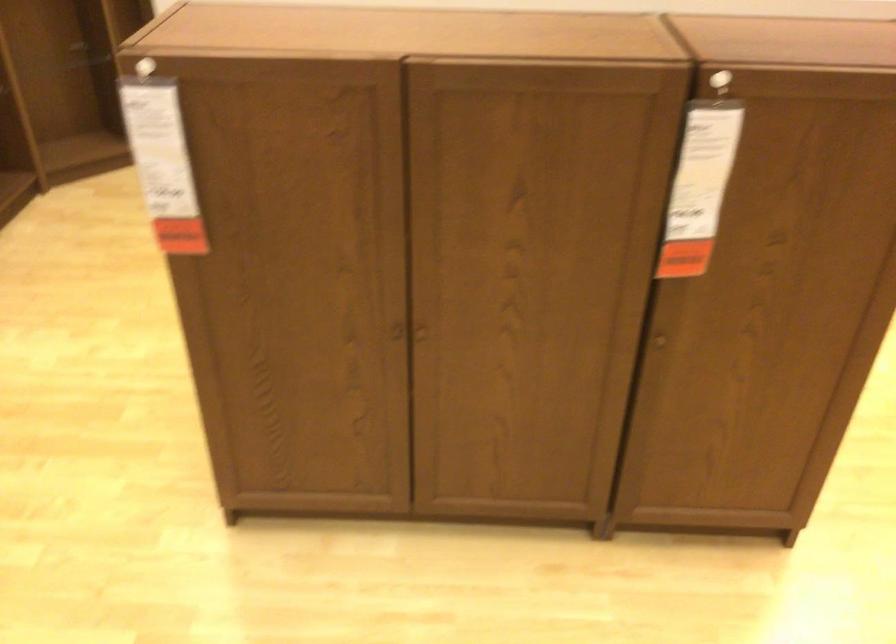
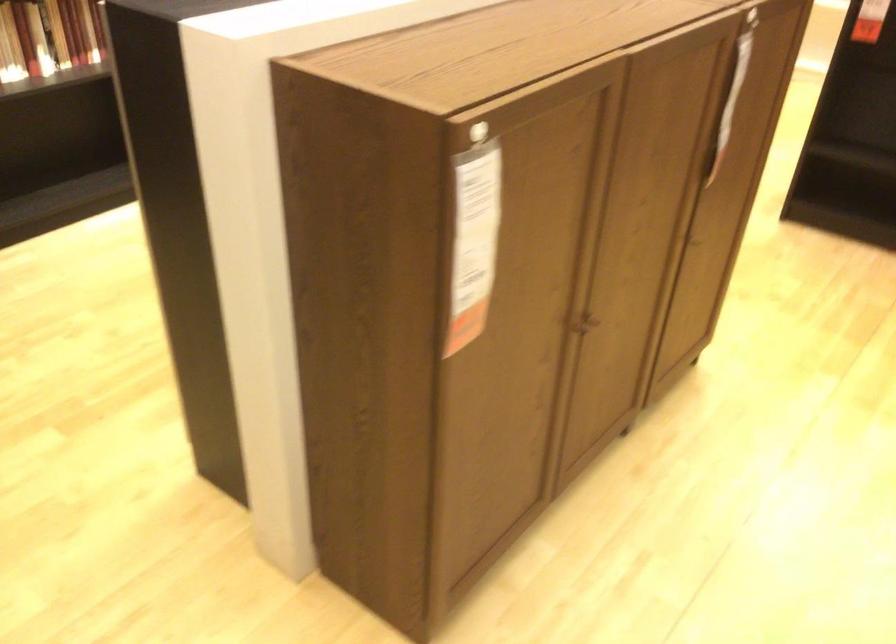
Find the pixel in the second image that matches (400,325) in the first image.

(583, 323)